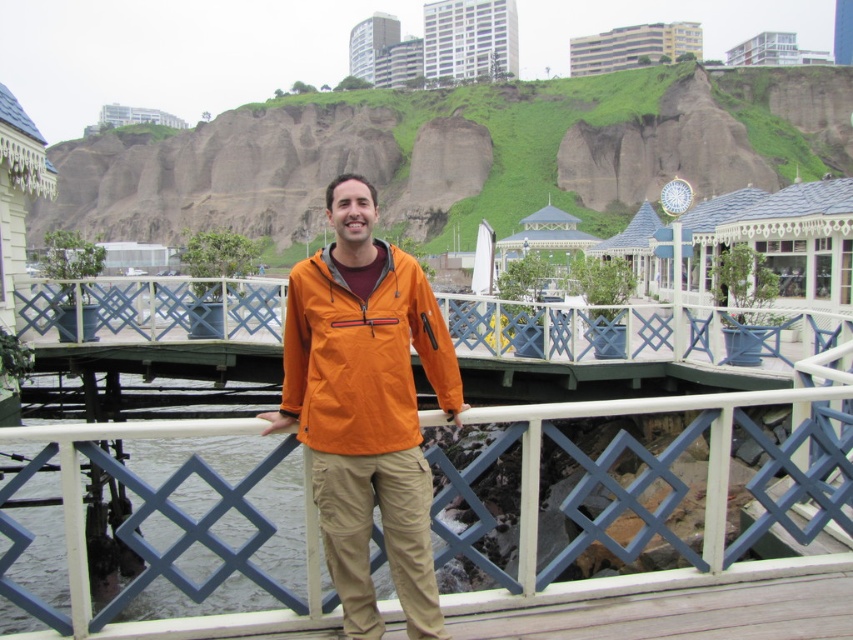
How distant is orange fabric jacket at center from orange softshell jacket at center?

The distance of orange fabric jacket at center from orange softshell jacket at center is 55.23 centimeters.

Is orange fabric jacket at center smaller than orange softshell jacket at center?

Actually, orange fabric jacket at center might be larger than orange softshell jacket at center.

Where is `orange fabric jacket at center`? orange fabric jacket at center is located at coordinates (366, 406).

Image resolution: width=853 pixels, height=640 pixels. Identify the location of orange fabric jacket at center. (366, 406).

Describe the element at coordinates (656, 496) in the screenshot. I see `white painted wood at center` at that location.

Does white painted wood at center have a larger size compared to orange softshell jacket at center?

Yes, white painted wood at center is bigger than orange softshell jacket at center.

Is point (248, 436) closer to viewer compared to point (309, 410)?

No, it is not.

Find the location of a particular element. The image size is (853, 640). white painted wood at center is located at coordinates (x=656, y=496).

Is white painted wood at center wider than orange fabric jacket at center?

Indeed, white painted wood at center has a greater width compared to orange fabric jacket at center.

Is white painted wood at center shorter than orange fabric jacket at center?

No, white painted wood at center is not shorter than orange fabric jacket at center.

This screenshot has width=853, height=640. Describe the element at coordinates (656, 496) in the screenshot. I see `white painted wood at center` at that location.

You are a GUI agent. You are given a task and a screenshot of the screen. Output one action in this format:
    pyautogui.click(x=<x>, y=<y>)
    Task: Click on the white painted wood at center
    This screenshot has width=853, height=640.
    Given the screenshot: What is the action you would take?
    pyautogui.click(x=656, y=496)